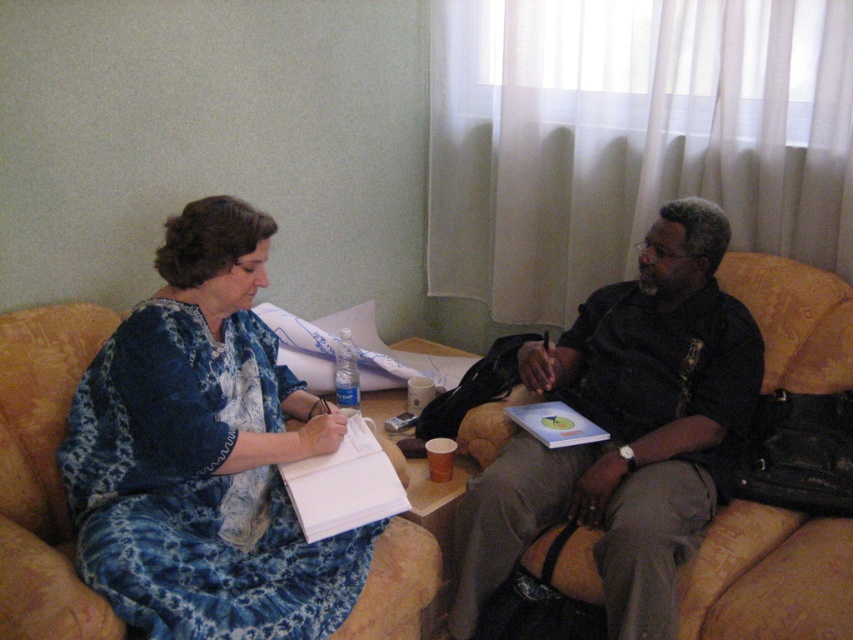
You are standing in the room and want to hand a book to the person wearing the dark brown leather jacket at center. Which direction should you walk to reach them from the blue printed dress at left?

The blue printed dress at left is to the left of the dark brown leather jacket at center, so you should walk to the right to reach the dark brown leather jacket at center from the blue printed dress at left.

You are a fashion designer observing the scene. You need to determine which item of clothing is smaller between the blue printed dress at left and the dark brown leather jacket at center. Which one would you choose?

The blue printed dress at left is smaller than the dark brown leather jacket at center, so the blue printed dress at left is the smaller clothing item.

You are a photographer standing in the room and want to take a picture of both the blue printed dress at left and the dark brown leather jacket at center. Which object should you focus on first if you want to capture both in the same frame without moving the camera?

The blue printed dress at left is located above the dark brown leather jacket at center, so you should focus on the blue printed dress at left first to ensure both are in the frame.